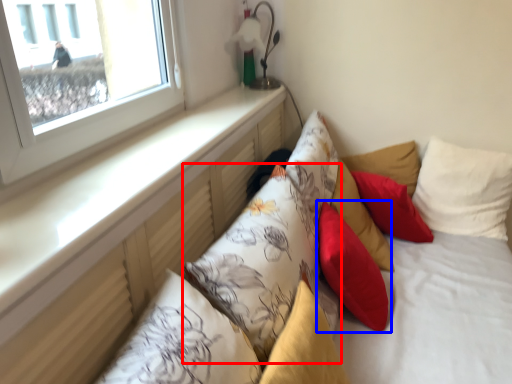
Question: Which object appears closest to the camera in this image, pillow (highlighted by a red box) or pillow (highlighted by a blue box)?

Choices:
 (A) pillow
 (B) pillow

Answer: (A)